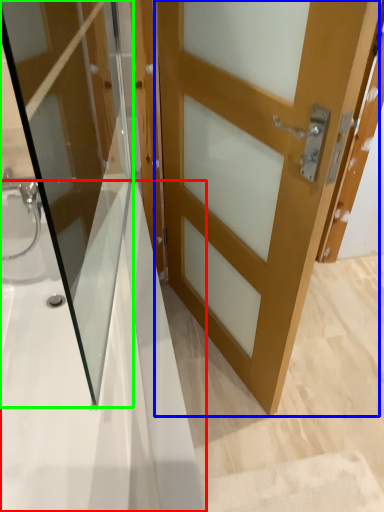
Question: Based on their relative distances, which object is nearer to bath (highlighted by a red box)? Choose from door (highlighted by a blue box) and door (highlighted by a green box).

Choices:
 (A) door
 (B) door

Answer: (B)